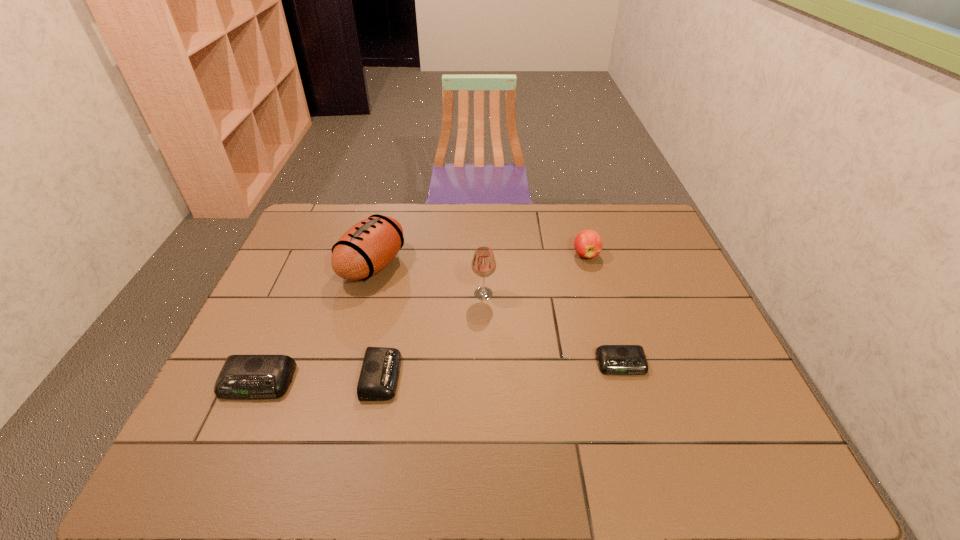
Where is `free space between the wineglass and the football (American)`? free space between the wineglass and the football (American) is located at coordinates (428, 280).

The width and height of the screenshot is (960, 540). In order to click on free space between the fifth tallest object and the apple in this screenshot , I will do `click(484, 315)`.

Image resolution: width=960 pixels, height=540 pixels. In order to click on vacant point located between the fifth tallest object and the leftmost alarm clock in this screenshot , I will do `click(320, 379)`.

Image resolution: width=960 pixels, height=540 pixels. I want to click on vacant area that lies between the football (American) and the second alarm clock from left to right, so click(x=377, y=321).

This screenshot has width=960, height=540. In order to click on free space between the shortest object and the leftmost object in this screenshot , I will do `click(440, 373)`.

Locate which object is the fifth closest to the football (American). Please provide its 2D coordinates. Your answer should be formatted as a tuple, i.e. [(x, y)], where the tuple contains the x and y coordinates of a point satisfying the conditions above.

[(612, 359)]

Locate which object ranks second in proximity to the apple. Please provide its 2D coordinates. Your answer should be formatted as a tuple, i.e. [(x, y)], where the tuple contains the x and y coordinates of a point satisfying the conditions above.

[(612, 359)]

Identify the location of alarm clock identified as the second closest to the leftmost alarm clock. (612, 359).

You are a GUI agent. You are given a task and a screenshot of the screen. Output one action in this format:
    pyautogui.click(x=<x>, y=<y>)
    Task: Click on the alarm clock that is the second closest to the football (American)
    Image resolution: width=960 pixels, height=540 pixels.
    Given the screenshot: What is the action you would take?
    pyautogui.click(x=242, y=376)

I want to click on blank area in the image that satisfies the following two spatial constraints: 1. on the display of the fifth tallest object; 2. on the display of the leftmost object, so click(x=380, y=382).